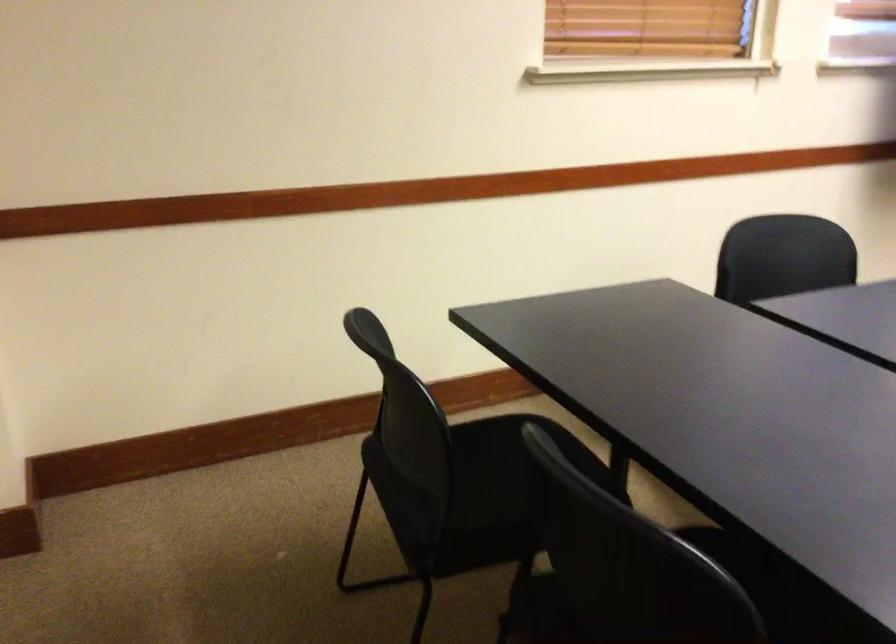
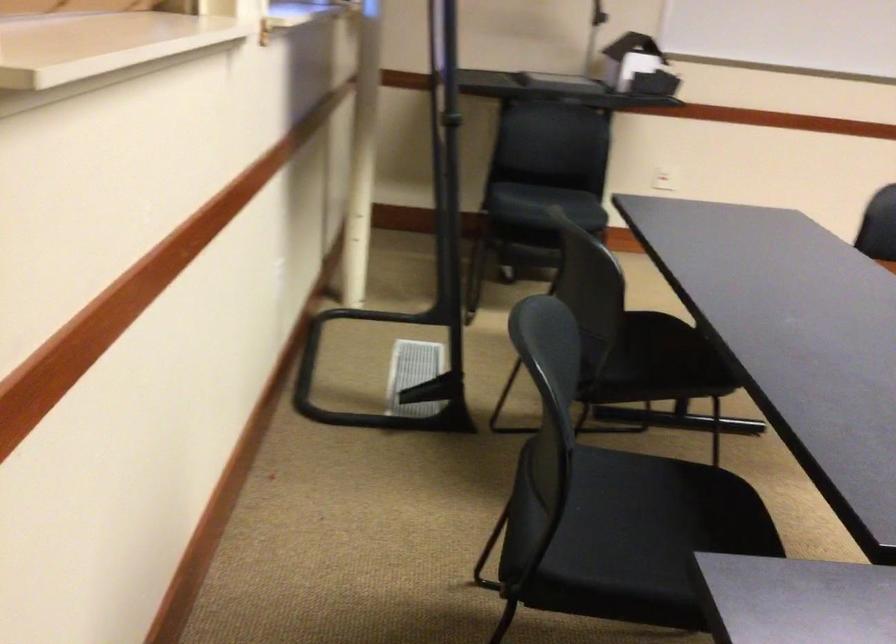
The first image is from the beginning of the video and the second image is from the end. How did the camera likely rotate when shooting the video?

The camera's rotation is toward right-down.